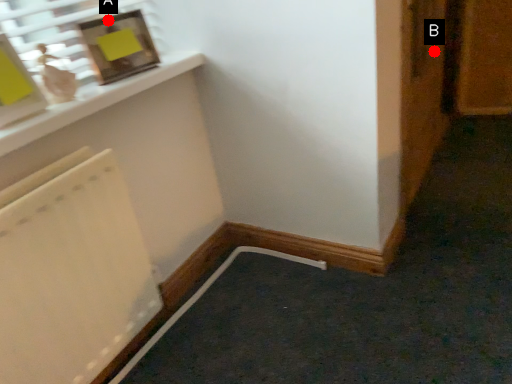
Question: Two points are circled on the image, labeled by A and B beside each circle. Among these points, which one is farthest from the camera?

Choices:
 (A) A is further
 (B) B is further

Answer: (B)